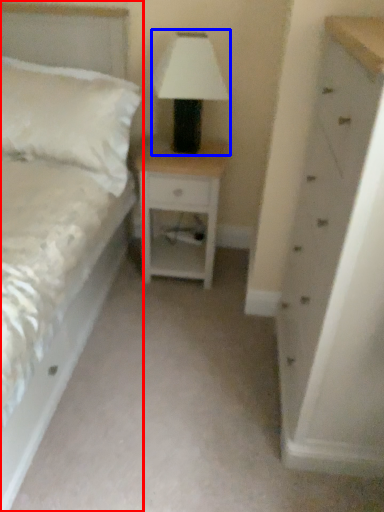
Question: Which object appears farthest to the camera in this image, bed (highlighted by a red box) or table lamp (highlighted by a blue box)?

Choices:
 (A) bed
 (B) table lamp

Answer: (B)